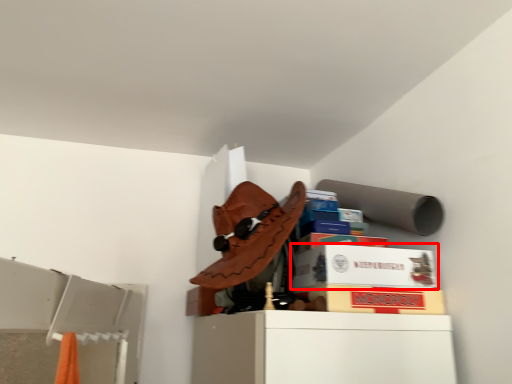
Question: From the image's perspective, where is cardboard box (annotated by the red box) located in relation to cardboard box in the image?

Choices:
 (A) above
 (B) below

Answer: (A)